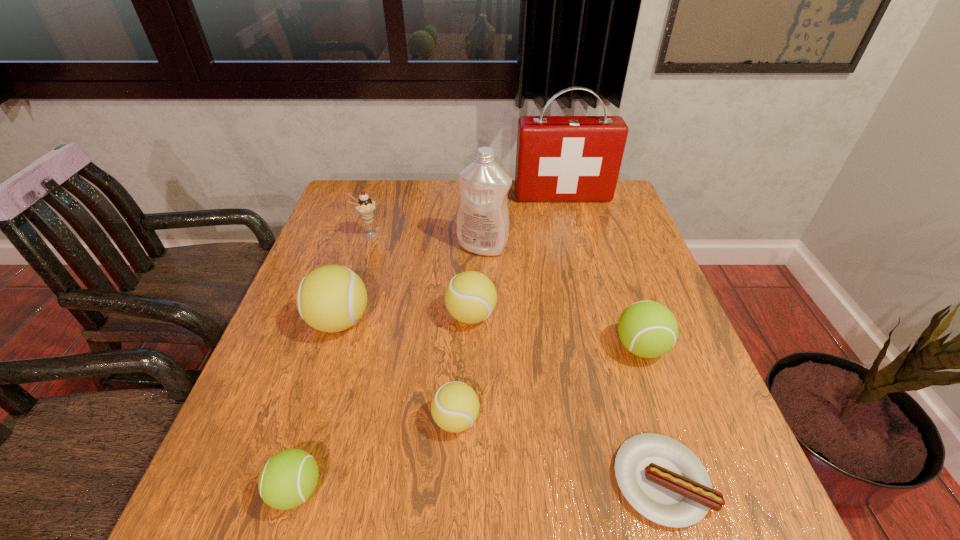
In order to click on the tallest object in this screenshot , I will do `click(559, 158)`.

You are a GUI agent. You are given a task and a screenshot of the screen. Output one action in this format:
    pyautogui.click(x=<x>, y=<y>)
    Task: Click on the farthest object
    
    Given the screenshot: What is the action you would take?
    pyautogui.click(x=559, y=158)

Where is `detergent`? detergent is located at coordinates (483, 221).

Locate an element on the screen. the second tallest object is located at coordinates (483, 221).

Where is `icecream`? icecream is located at coordinates (364, 205).

At what (x,y) coordinates should I click in order to perform the action: click on the biggest yellow tennis ball. Please return your answer as a coordinate pair (x, y). Looking at the image, I should click on (332, 298).

Locate an element on the screen. The height and width of the screenshot is (540, 960). the tallest tennis ball is located at coordinates (332, 298).

This screenshot has width=960, height=540. Find the location of `the second smallest yellow tennis ball`. the second smallest yellow tennis ball is located at coordinates (470, 297).

Locate an element on the screen. the bigger green tennis ball is located at coordinates (648, 329).

Where is `the farther green tennis ball`? Image resolution: width=960 pixels, height=540 pixels. the farther green tennis ball is located at coordinates (648, 329).